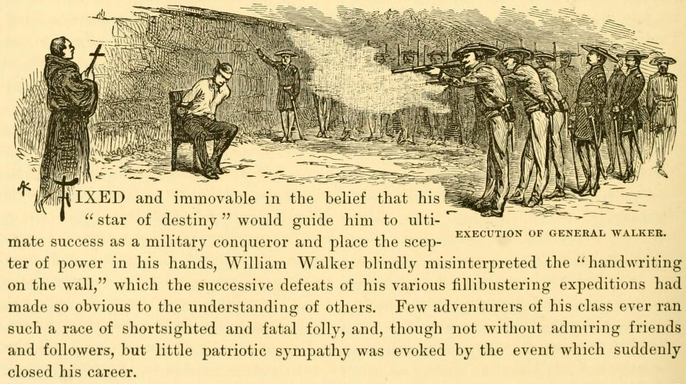
You are a GUI agent. You are given a task and a screenshot of the screen. Output one action in this format:
    pyautogui.click(x=<x>, y=<y>)
    Task: Click on the crucifix
    The image size is (686, 384).
    Given the screenshot: What is the action you would take?
    pyautogui.click(x=92, y=54)